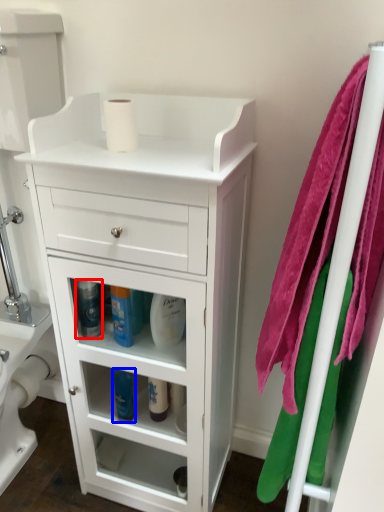
Question: Which object is further to the camera taking this photo, cleaning product (highlighted by a red box) or cleaning product (highlighted by a blue box)?

Choices:
 (A) cleaning product
 (B) cleaning product

Answer: (B)